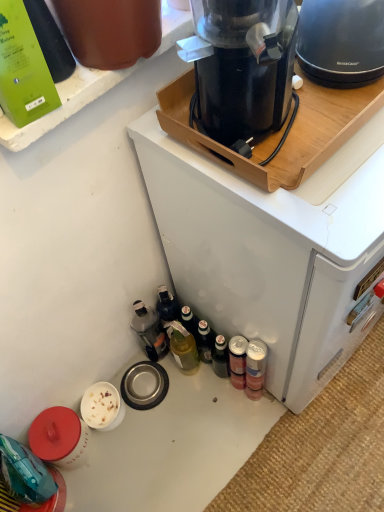
The height and width of the screenshot is (512, 384). I want to click on translucent plastic bottle at lower left, arranged as the 2th bottle when viewed from the top, so click(149, 331).

What is the approximate width of matte black kettle at upper right, which appears as the 2th kitchen appliance when viewed from the left?

matte black kettle at upper right, which appears as the 2th kitchen appliance when viewed from the left, is 7.47 inches in width.

Identify the location of black plastic coffee maker at upper center, which appears as the second kitchen appliance when viewed from the right. This screenshot has height=512, width=384. click(243, 68).

Image resolution: width=384 pixels, height=512 pixels. Describe the element at coordinates (255, 368) in the screenshot. I see `metallic silver can at lower right, marked as the second bottle in a front-to-back arrangement` at that location.

How much space does metallic silver can at lower right, marked as the second bottle in a front-to-back arrangement, occupy horizontally?

It is 2.70 inches.

You are a GUI agent. You are given a task and a screenshot of the screen. Output one action in this format:
    pyautogui.click(x=<x>, y=<y>)
    Task: Click on the translucent plastic bottle at lower left, placed as the first bottle when sorted from back to front
    The image size is (384, 512).
    Given the screenshot: What is the action you would take?
    pyautogui.click(x=149, y=331)

Which of these two, black plastic coffee maker at upper center or translucent plastic bottle at lower left, placed as the first bottle when sorted from back to front, is bigger?

black plastic coffee maker at upper center.

Between black plastic coffee maker at upper center and translucent plastic bottle at lower left, which is the third bottle in front-to-back order, which one is positioned in front?

black plastic coffee maker at upper center is closer to the camera.

Can you confirm if black plastic coffee maker at upper center is wider than translucent plastic bottle at lower left, which is counted as the 2th bottle, starting from the left?

Indeed, black plastic coffee maker at upper center has a greater width compared to translucent plastic bottle at lower left, which is counted as the 2th bottle, starting from the left.

Starting from the black plastic coffee maker at upper center, which bottle is the 2nd one behind? Please provide its 2D coordinates.

[(149, 331)]

The image size is (384, 512). In the image, there is a matte black kettle at upper right, which appears as the 2th kitchen appliance when viewed from the left. Find the location of `home appliance below it (from the image's perspective)`. home appliance below it (from the image's perspective) is located at coordinates (272, 251).

Is black plastic coffee maker at upper center not near matte black kettle at upper right, which appears as the 2th kitchen appliance when viewed from the left?

No, black plastic coffee maker at upper center is not far from matte black kettle at upper right, which appears as the 2th kitchen appliance when viewed from the left.

Does point (360, 151) come farther from viewer compared to point (324, 71)?

No.

Considering the relative positions of green matte bottle at upper left, which is counted as the third bottle, starting from the back, and black plastic coffee maker at upper center, which is the first kitchen appliance from left to right, in the image provided, is green matte bottle at upper left, which is counted as the third bottle, starting from the back, to the right of black plastic coffee maker at upper center, which is the first kitchen appliance from left to right, from the viewer's perspective?

No.

Consider the image. Measure the distance from green matte bottle at upper left, the 3th bottle positioned from the right, to black plastic coffee maker at upper center, which appears as the second kitchen appliance when viewed from the right.

The distance of green matte bottle at upper left, the 3th bottle positioned from the right, from black plastic coffee maker at upper center, which appears as the second kitchen appliance when viewed from the right, is 10.58 inches.

Is green matte bottle at upper left, which appears as the first bottle when viewed from the front, completely or partially outside of black plastic coffee maker at upper center, which appears as the second kitchen appliance when viewed from the right?

Indeed, green matte bottle at upper left, which appears as the first bottle when viewed from the front, is completely outside black plastic coffee maker at upper center, which appears as the second kitchen appliance when viewed from the right.

Is green matte bottle at upper left, the 3th bottle positioned from the right, facing towards black plastic coffee maker at upper center, which appears as the second kitchen appliance when viewed from the right?

No.

Can we say translucent plastic bottle at lower left, which is counted as the 2th bottle, starting from the left, lies outside matte black kettle at upper right, which is the 1th kitchen appliance from right to left?

Absolutely, translucent plastic bottle at lower left, which is counted as the 2th bottle, starting from the left, is external to matte black kettle at upper right, which is the 1th kitchen appliance from right to left.

From a real-world perspective, is translucent plastic bottle at lower left, which is counted as the 2th bottle, starting from the left, physically located above or below matte black kettle at upper right, which appears as the 2th kitchen appliance when viewed from the left?

Clearly, from a real-world perspective, translucent plastic bottle at lower left, which is counted as the 2th bottle, starting from the left, is below matte black kettle at upper right, which appears as the 2th kitchen appliance when viewed from the left.

Find the location of a particular element. the 2nd kitchen appliance above the translucent plastic bottle at lower left, placed as the first bottle when sorted from back to front (from the image's perspective) is located at coordinates (341, 41).

Can you confirm if translucent plastic bottle at lower left, arranged as the second bottle when ordered from the bottom, is taller than matte black kettle at upper right, which appears as the 2th kitchen appliance when viewed from the left?

Yes.

Relative to translucent plastic bottle at lower left, acting as the 2th bottle starting from the right, is black plastic coffee maker at upper center, which appears as the second kitchen appliance when viewed from the right, in front or behind?

In the image, black plastic coffee maker at upper center, which appears as the second kitchen appliance when viewed from the right, appears in front of translucent plastic bottle at lower left, acting as the 2th bottle starting from the right.

From a real-world perspective, starting from the translucent plastic bottle at lower left, placed as the first bottle when sorted from back to front, which kitchen appliance is the 2nd one vertically above it? Please provide its 2D coordinates.

[(243, 68)]

From the image's perspective, which one is positioned lower, black plastic coffee maker at upper center, which is the first kitchen appliance from left to right, or translucent plastic bottle at lower left, which is the third bottle in front-to-back order?

translucent plastic bottle at lower left, which is the third bottle in front-to-back order.

How different are the orientations of black plastic coffee maker at upper center, which is the first kitchen appliance from left to right, and translucent plastic bottle at lower left, which is the third bottle in front-to-back order, in degrees?

56.3 degrees separate the facing orientations of black plastic coffee maker at upper center, which is the first kitchen appliance from left to right, and translucent plastic bottle at lower left, which is the third bottle in front-to-back order.

Is green matte bottle at upper left, which ranks as the first bottle in top-to-bottom order, turned away from metallic silver can at lower right, marked as the second bottle in a front-to-back arrangement?

No, green matte bottle at upper left, which ranks as the first bottle in top-to-bottom order, is not facing away from metallic silver can at lower right, marked as the second bottle in a front-to-back arrangement.

From a real-world perspective, which is physically above, green matte bottle at upper left, which appears as the first bottle when viewed from the front, or metallic silver can at lower right, marked as the second bottle in a front-to-back arrangement?

green matte bottle at upper left, which appears as the first bottle when viewed from the front, is physically above.

Does green matte bottle at upper left, marked as the third bottle in a bottom-to-top arrangement, have a greater width compared to metallic silver can at lower right, marked as the second bottle in a front-to-back arrangement?

Correct, the width of green matte bottle at upper left, marked as the third bottle in a bottom-to-top arrangement, exceeds that of metallic silver can at lower right, marked as the second bottle in a front-to-back arrangement.

How many degrees apart are the facing directions of green matte bottle at upper left, which is counted as the third bottle, starting from the back, and metallic silver can at lower right, the 2th bottle viewed from the back?

The facing directions of green matte bottle at upper left, which is counted as the third bottle, starting from the back, and metallic silver can at lower right, the 2th bottle viewed from the back, are 5.4 degrees apart.

Considering the relative sizes of black plastic coffee maker at upper center, which appears as the second kitchen appliance when viewed from the right, and matte black kettle at upper right, which appears as the 2th kitchen appliance when viewed from the left, in the image provided, is black plastic coffee maker at upper center, which appears as the second kitchen appliance when viewed from the right, shorter than matte black kettle at upper right, which appears as the 2th kitchen appliance when viewed from the left,?

No, black plastic coffee maker at upper center, which appears as the second kitchen appliance when viewed from the right, is not shorter than matte black kettle at upper right, which appears as the 2th kitchen appliance when viewed from the left.

From a real-world perspective, which is physically above, black plastic coffee maker at upper center, which appears as the second kitchen appliance when viewed from the right, or matte black kettle at upper right, which appears as the 2th kitchen appliance when viewed from the left?

In real-world perspective, black plastic coffee maker at upper center, which appears as the second kitchen appliance when viewed from the right, is above.

Can you confirm if black plastic coffee maker at upper center, which appears as the second kitchen appliance when viewed from the right, is positioned to the left of matte black kettle at upper right, which is the 1th kitchen appliance from right to left?

Yes.

Looking at their sizes, would you say black plastic coffee maker at upper center, which is the first kitchen appliance from left to right, is wider or thinner than matte black kettle at upper right, which appears as the 2th kitchen appliance when viewed from the left?

In the image, black plastic coffee maker at upper center, which is the first kitchen appliance from left to right, appears to be wider than matte black kettle at upper right, which appears as the 2th kitchen appliance when viewed from the left.

At what (x,y) coordinates should I click in order to perform the action: click on home appliance in front of the translucent plastic bottle at lower left, arranged as the 2th bottle when viewed from the top. Please return your answer as a coordinate pair (x, y). Image resolution: width=384 pixels, height=512 pixels. Looking at the image, I should click on (272, 251).

Identify the location of home appliance below the matte black kettle at upper right, which is the 1th kitchen appliance from right to left (from the image's perspective). (272, 251).

Looking at the image, which one is located closer to metallic silver can at lower right, which appears as the 1th bottle when ordered from the bottom, black plastic coffee maker at upper center, which is the first kitchen appliance from left to right, or black plastic coffee maker at upper center?

black plastic coffee maker at upper center is positioned closer to the anchor metallic silver can at lower right, which appears as the 1th bottle when ordered from the bottom.

Estimate the real-world distances between objects in this image. Which object is further from green matte bottle at upper left, marked as the third bottle in a bottom-to-top arrangement, black plastic coffee maker at upper center or translucent plastic bottle at lower left, arranged as the 2th bottle when viewed from the top?

translucent plastic bottle at lower left, arranged as the 2th bottle when viewed from the top.

From the image, which object appears to be nearer to matte black kettle at upper right, which appears as the 2th kitchen appliance when viewed from the left, translucent plastic bottle at lower left, acting as the 2th bottle starting from the right, or green matte bottle at upper left, the 3th bottle positioned from the right?

Based on the image, green matte bottle at upper left, the 3th bottle positioned from the right, appears to be nearer to matte black kettle at upper right, which appears as the 2th kitchen appliance when viewed from the left.

Looking at the image, which one is located closer to matte black kettle at upper right, which is the 1th kitchen appliance from right to left, metallic silver can at lower right, the 1th bottle viewed from the right, or black plastic coffee maker at upper center?

black plastic coffee maker at upper center is positioned closer to the anchor matte black kettle at upper right, which is the 1th kitchen appliance from right to left.

Which object lies nearer to the anchor point matte black kettle at upper right, which appears as the 2th kitchen appliance when viewed from the left, black plastic coffee maker at upper center or green matte bottle at upper left, which appears as the first bottle when viewed from the front?

Based on the image, black plastic coffee maker at upper center appears to be nearer to matte black kettle at upper right, which appears as the 2th kitchen appliance when viewed from the left.

From the image, which object appears to be farther from matte black kettle at upper right, which is the 1th kitchen appliance from right to left, metallic silver can at lower right, marked as the second bottle in a front-to-back arrangement, or black plastic coffee maker at upper center, which is the first kitchen appliance from left to right?

Based on the image, metallic silver can at lower right, marked as the second bottle in a front-to-back arrangement, appears to be further to matte black kettle at upper right, which is the 1th kitchen appliance from right to left.

Looking at the image, which one is located further to green matte bottle at upper left, the first bottle when ordered from left to right, metallic silver can at lower right, the 2th bottle viewed from the back, or matte black kettle at upper right, which is the 1th kitchen appliance from right to left?

Answer: metallic silver can at lower right, the 2th bottle viewed from the back, lies further to green matte bottle at upper left, the first bottle when ordered from left to right, than the other object.

Which object lies further to the anchor point matte black kettle at upper right, which appears as the 2th kitchen appliance when viewed from the left, metallic silver can at lower right, which appears as the 1th bottle when ordered from the bottom, or green matte bottle at upper left, the first bottle when ordered from left to right?

Among the two, metallic silver can at lower right, which appears as the 1th bottle when ordered from the bottom, is located further to matte black kettle at upper right, which appears as the 2th kitchen appliance when viewed from the left.

You are a GUI agent. You are given a task and a screenshot of the screen. Output one action in this format:
    pyautogui.click(x=<x>, y=<y>)
    Task: Click on the home appliance between matte black kettle at upper right, which appears as the 2th kitchen appliance when viewed from the left, and translucent plastic bottle at lower left, arranged as the 2th bottle when viewed from the top, in the vertical direction
    
    Given the screenshot: What is the action you would take?
    pos(272,251)

Image resolution: width=384 pixels, height=512 pixels. In order to click on kitchen appliance between black plastic coffee maker at upper center, which is the first kitchen appliance from left to right, and translucent plastic bottle at lower left, arranged as the 2th bottle when viewed from the top, in the front-back direction in this screenshot , I will do `click(341, 41)`.

Locate an element on the screen. bottle between black plastic coffee maker at upper center, which is the first kitchen appliance from left to right, and translucent plastic bottle at lower left, arranged as the 2th bottle when viewed from the top, along the z-axis is located at coordinates (255, 368).

You are a GUI agent. You are given a task and a screenshot of the screen. Output one action in this format:
    pyautogui.click(x=<x>, y=<y>)
    Task: Click on the home appliance between matte black kettle at upper right, which appears as the 2th kitchen appliance when viewed from the left, and metallic silver can at lower right, the 2th bottle viewed from the back, in the up-down direction
    Image resolution: width=384 pixels, height=512 pixels.
    Given the screenshot: What is the action you would take?
    (x=272, y=251)